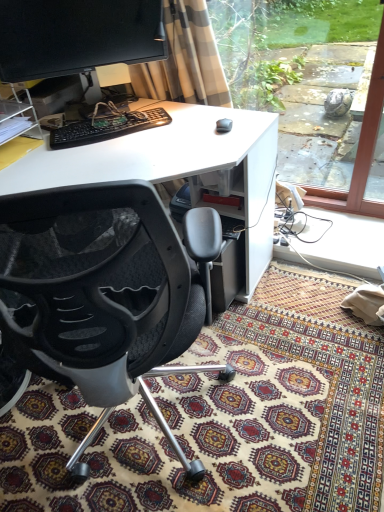
Where is `vacant space that is in between white plastic desk at center and black mesh chair at center`? vacant space that is in between white plastic desk at center and black mesh chair at center is located at coordinates (169, 380).